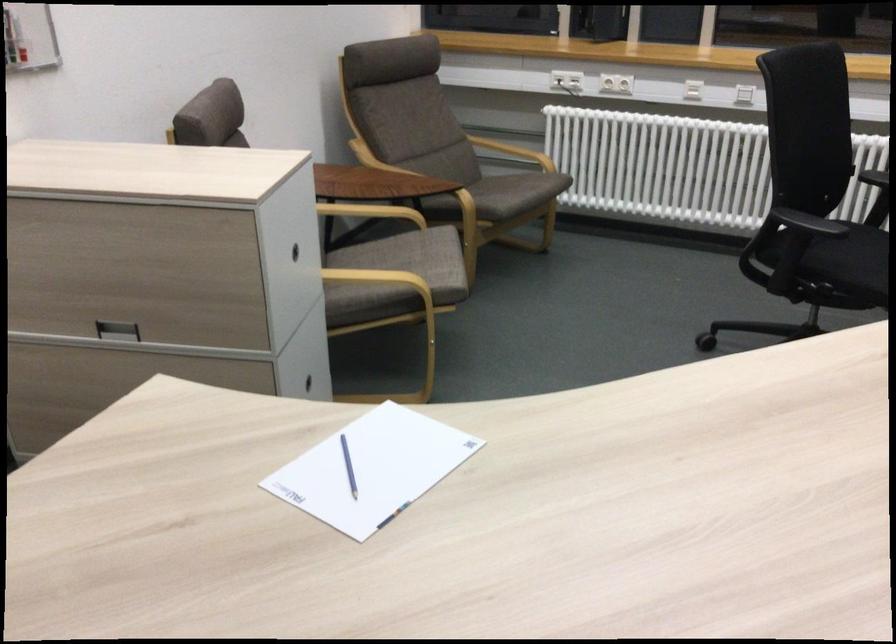
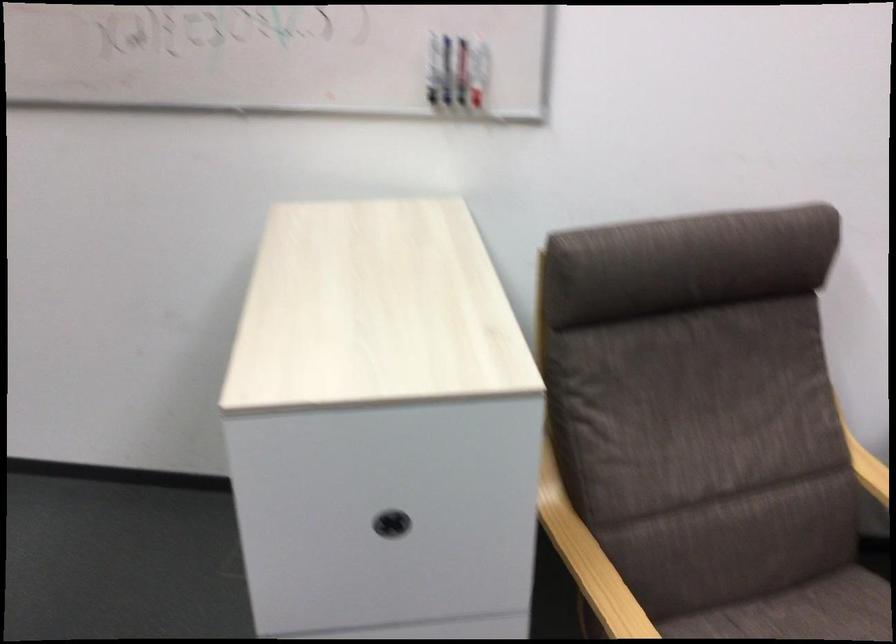
The point at (297, 252) is marked in the first image. Where is the corresponding point in the second image?

(391, 524)